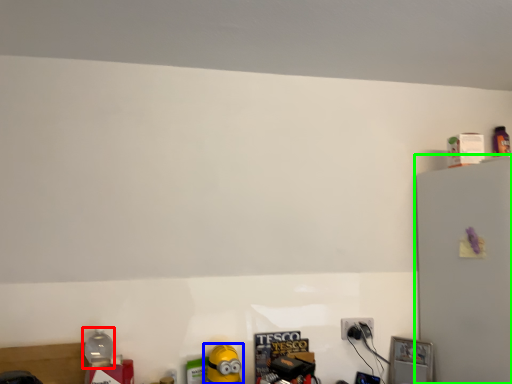
Question: Which object is positioned closest to bottle (highlighted by a red box)? Select from toy (highlighted by a blue box) and fridge (highlighted by a green box).

Choices:
 (A) toy
 (B) fridge

Answer: (A)